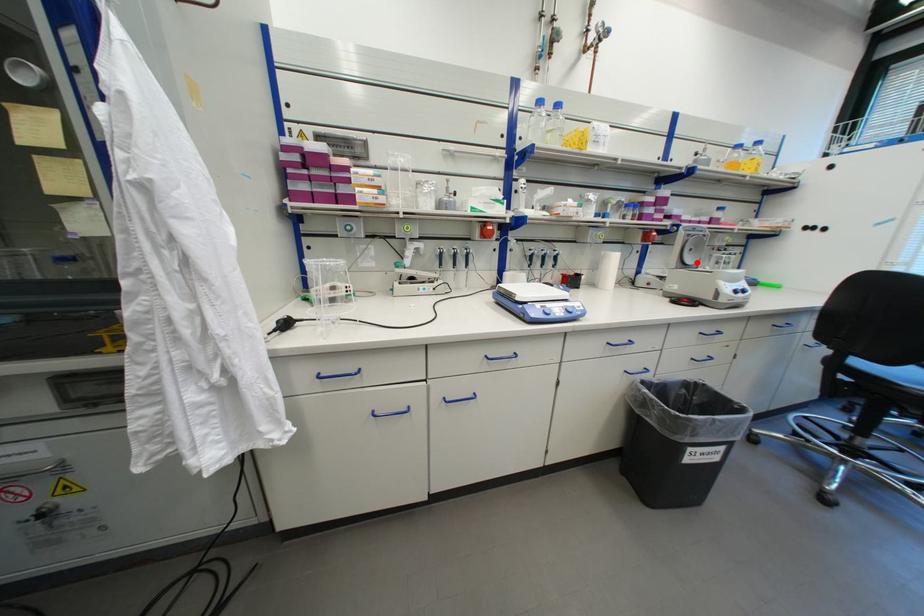
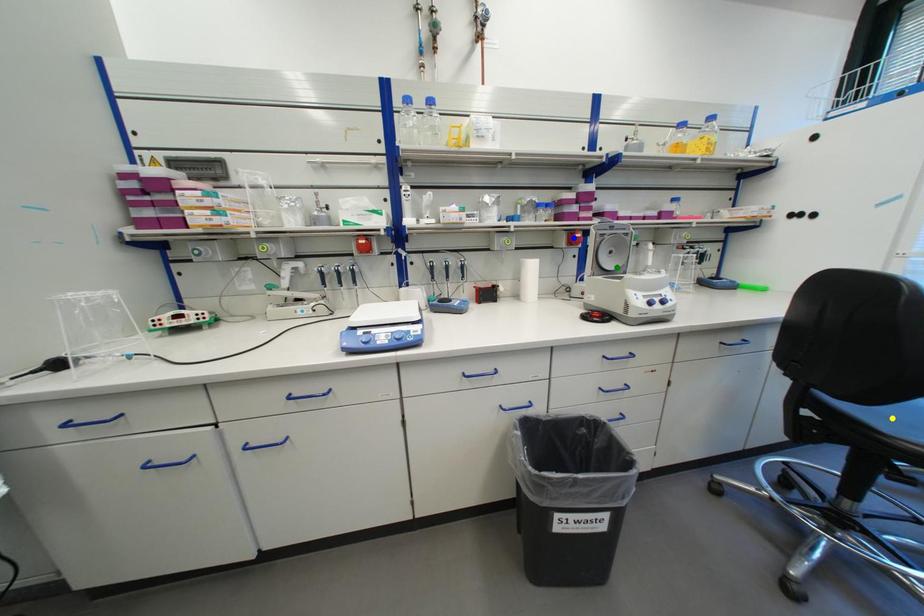
Question: I am providing you with two images of the same scene from different viewpoints. A red point is marked on the first image. You are given multiple points on the second image. Which point in image 2 represents the same 3d spot as the red point in image 1?

Choices:
 (A) blue point
 (B) yellow point
 (C) green point

Answer: (C)